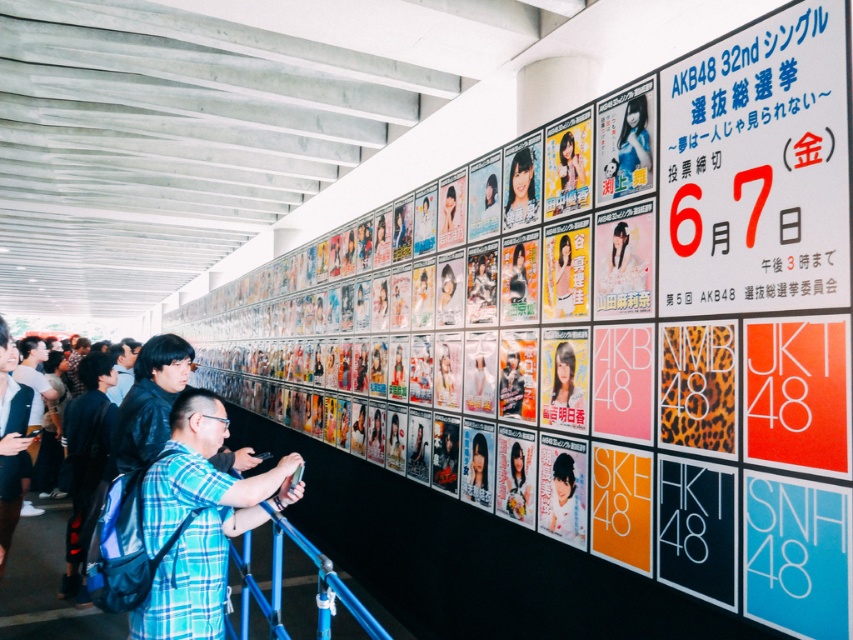
Can you confirm if blue plaid shirt at center is positioned to the right of dark blue shirt at center?

Yes, blue plaid shirt at center is to the right of dark blue shirt at center.

Which is more to the right, blue plaid shirt at center or dark blue shirt at center?

Positioned to the right is blue plaid shirt at center.

The height and width of the screenshot is (640, 853). Identify the location of blue plaid shirt at center. (196, 522).

Which is below, shiny blonde hair at center or dark blue shirt at center?

dark blue shirt at center

Which is above, shiny blonde hair at center or dark blue shirt at center?

shiny blonde hair at center

This screenshot has width=853, height=640. In order to click on shiny blonde hair at center in this screenshot , I will do `click(566, 378)`.

Is the position of matte plastic poster at center less distant than that of matte black poster at center?

No, it is behind matte black poster at center.

Is matte plastic poster at center above matte black poster at center?

Yes.

Does point (521, 204) come behind point (524, 520)?

Yes, point (521, 204) is behind point (524, 520).

What are the coordinates of `matte plastic poster at center` in the screenshot? It's located at (521, 189).